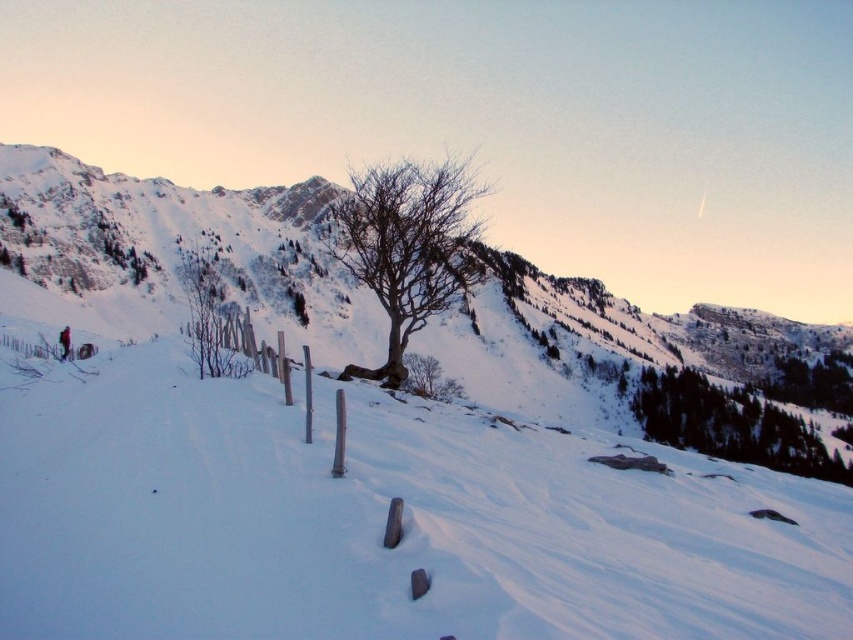
Question: Does bare wood tree at center appear over brown/rough tree at center-left?

Choices:
 (A) yes
 (B) no

Answer: (A)

Question: Which of the following is the farthest from the observer?

Choices:
 (A) white snow at center
 (B) brown/rough tree at center-left
 (C) bare wood tree at center

Answer: (C)

Question: Can you confirm if white snow at center is thinner than brown/rough tree at center-left?

Choices:
 (A) yes
 (B) no

Answer: (B)

Question: Among these objects, which one is farthest from the camera?

Choices:
 (A) bare wood tree at center
 (B) brown/rough tree at center-left

Answer: (A)

Question: Which of the following is the closest to the observer?

Choices:
 (A) (218, 369)
 (B) (410, 170)
 (C) (254, 406)

Answer: (C)

Question: Can you confirm if white snow at center is thinner than brown/rough tree at center-left?

Choices:
 (A) yes
 (B) no

Answer: (B)